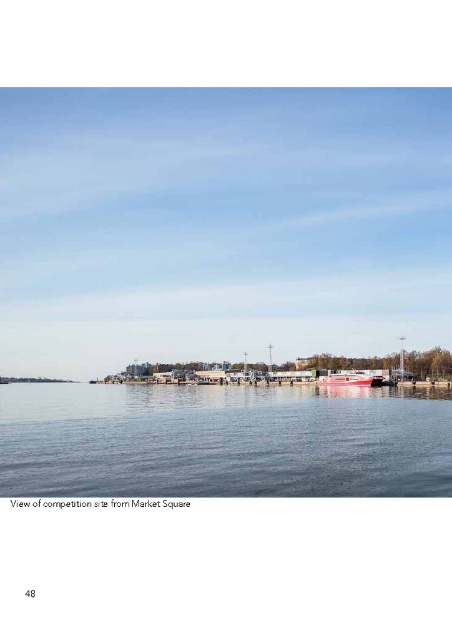
You are standing at Market Square and want to take a photo of the waterfront. There are two points of interest marked as point 1 at coordinates (156,445) and point 2 at coordinates (328,378). Which point will appear closer to the camera in your photo?

Point 1 at coordinates (156,445) will appear closer to the camera because it is in front of point 2 at coordinates (328,378).

You are standing at Market Square and want to take a photo of the red glossy boat at center without the transparent blue water at center in the shot. Which direction should you move to ensure the boat is visible but the water is out of frame?

Move to the right so that the red glossy boat at center blocks the view of the transparent blue water at center, which is located to the left of the boat.